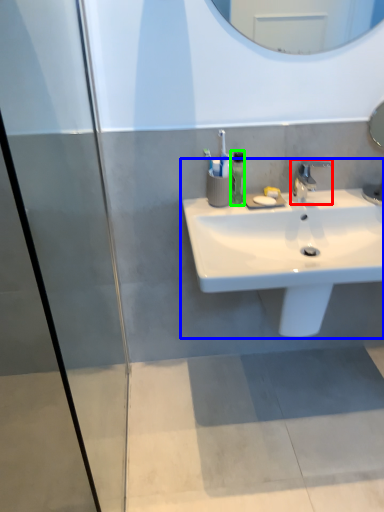
Question: Which object is positioned farthest from tap (highlighted by a red box)? Select from sink (highlighted by a blue box) and soap dispenser (highlighted by a green box).

Choices:
 (A) sink
 (B) soap dispenser

Answer: (A)